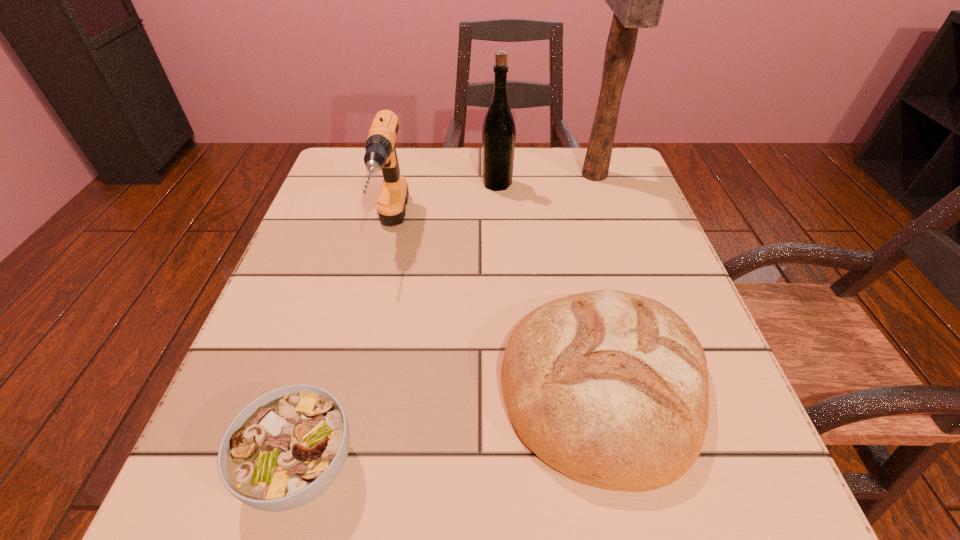
Find the location of a particular element. This screenshot has height=540, width=960. blank region between the beer bottle and the tallest object is located at coordinates pos(546,179).

You are a GUI agent. You are given a task and a screenshot of the screen. Output one action in this format:
    pyautogui.click(x=<x>, y=<y>)
    Task: Click on the empty space between the soup bowl and the bread
    The height and width of the screenshot is (540, 960).
    Given the screenshot: What is the action you would take?
    453,426

Locate an element on the screen. vacant space that is in between the fourth shortest object and the bread is located at coordinates (551, 285).

In order to click on vacant region between the shortest object and the third shortest object in this screenshot , I will do `click(347, 348)`.

Identify the location of vacant region between the bread and the fourth shortest object. The image size is (960, 540). (551, 285).

Find the location of a particular element. The image size is (960, 540). blank region between the drill and the beer bottle is located at coordinates (444, 206).

You are a GUI agent. You are given a task and a screenshot of the screen. Output one action in this format:
    pyautogui.click(x=<x>, y=<y>)
    Task: Click on the vacant space that is in between the third tallest object and the bread
    The image size is (960, 540).
    Given the screenshot: What is the action you would take?
    pyautogui.click(x=497, y=307)

The height and width of the screenshot is (540, 960). I want to click on free area in between the mallet and the bread, so click(x=599, y=280).

Where is `vacant space in between the beer bottle and the shortest object`? vacant space in between the beer bottle and the shortest object is located at coordinates (400, 325).

Find the location of a particular element. object that stands as the closest to the third tallest object is located at coordinates point(498,132).